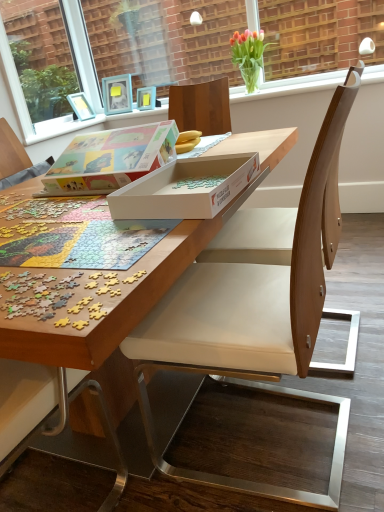
At what (x,y) coordinates should I click in order to perform the action: click on free space above multicolored plastic jigsaw puzzle pieces at lower left (from a real-world perspective). Please return your answer as a coordinate pair (x, y). The width and height of the screenshot is (384, 512). Looking at the image, I should click on (36, 278).